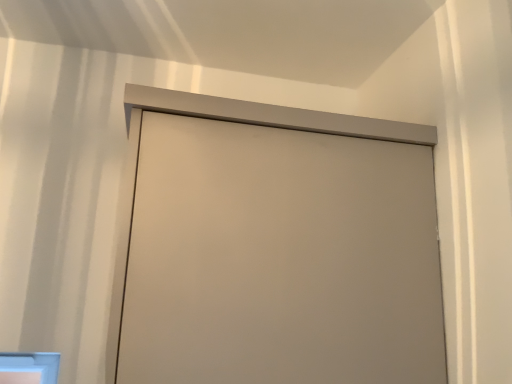
Identify the location of matte gray door at center. (280, 258).

Describe the element at coordinates (280, 258) in the screenshot. I see `matte gray door at center` at that location.

Locate an element on the screen. This screenshot has width=512, height=384. matte gray door at center is located at coordinates (280, 258).